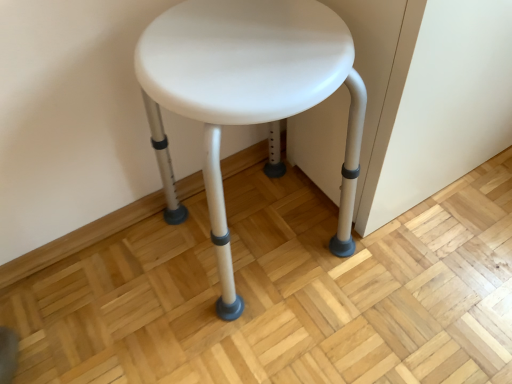
Identify the location of vacant space to the right of white plastic stool at center. The image size is (512, 384). (404, 275).